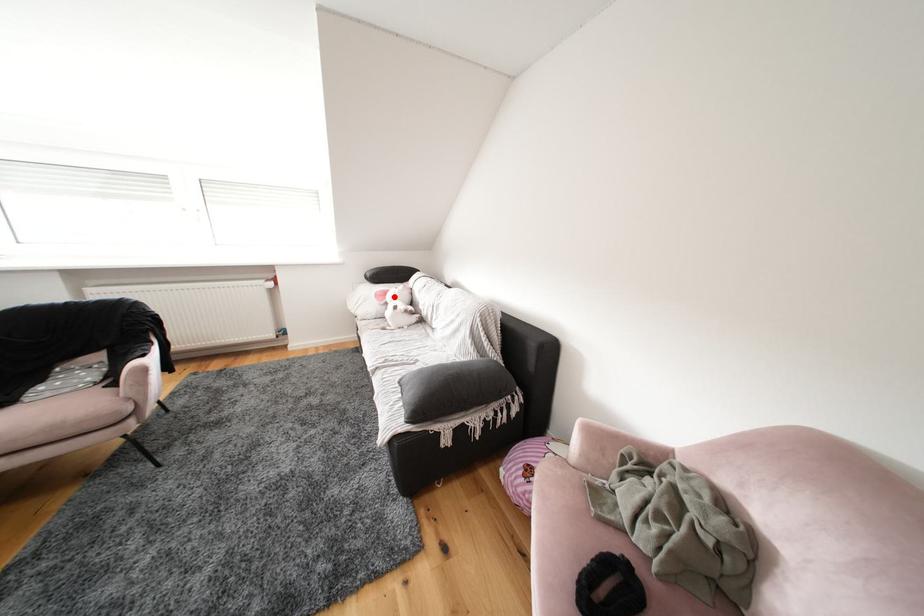
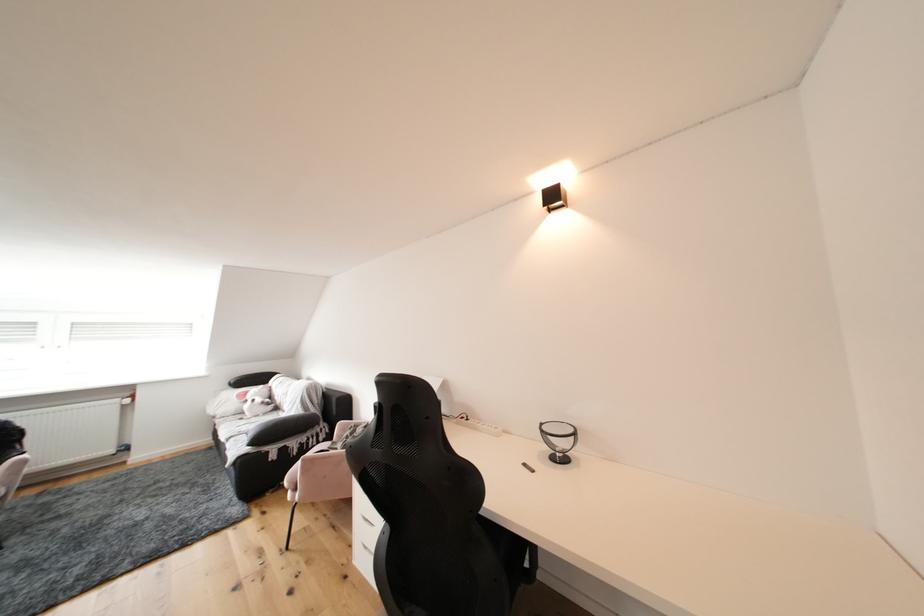
In the second image, find the point that corresponds to the highlighted location in the first image.

(256, 397)